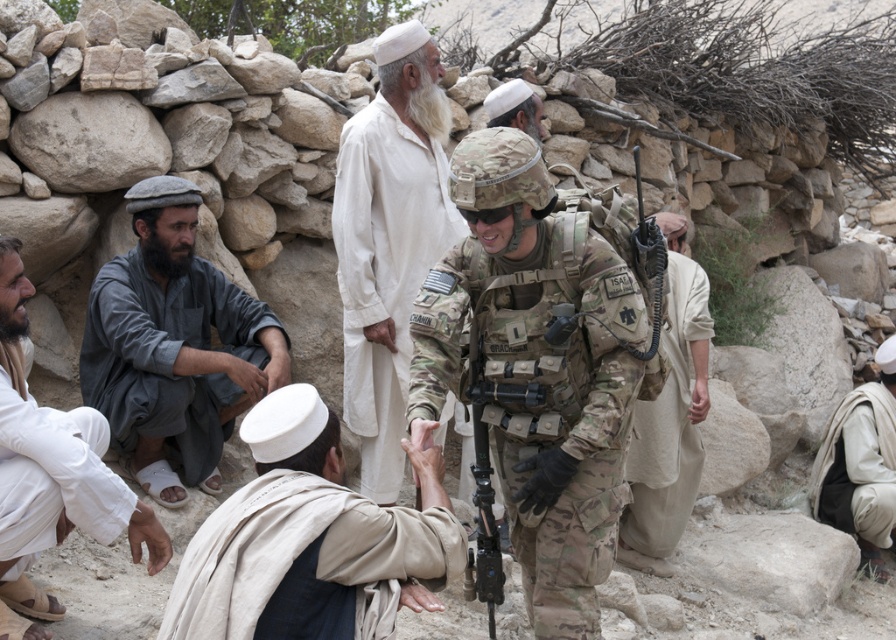
Does light beige fabric at lower center have a larger size compared to white cotton robe at center?

No, light beige fabric at lower center is not bigger than white cotton robe at center.

What do you see at coordinates (304, 541) in the screenshot? I see `light beige fabric at lower center` at bounding box center [304, 541].

Image resolution: width=896 pixels, height=640 pixels. I want to click on light beige fabric at lower center, so click(304, 541).

Which is above, white cotton robe at lower left or camouflage uniform at center?

camouflage uniform at center is above.

This screenshot has width=896, height=640. In order to click on white cotton robe at lower left in this screenshot , I will do coord(53,474).

This screenshot has height=640, width=896. I want to click on white cotton robe at lower left, so click(x=53, y=474).

Who is more forward, (539, 630) or (668, 316)?

Positioned in front is point (539, 630).

Can you confirm if camouflage fabric uniform at center is positioned to the left of beige cotton robe at center-right?

Correct, you'll find camouflage fabric uniform at center to the left of beige cotton robe at center-right.

Does point (519, 488) come farther from viewer compared to point (647, 538)?

No.

Locate an element on the screen. The height and width of the screenshot is (640, 896). camouflage fabric uniform at center is located at coordinates (541, 388).